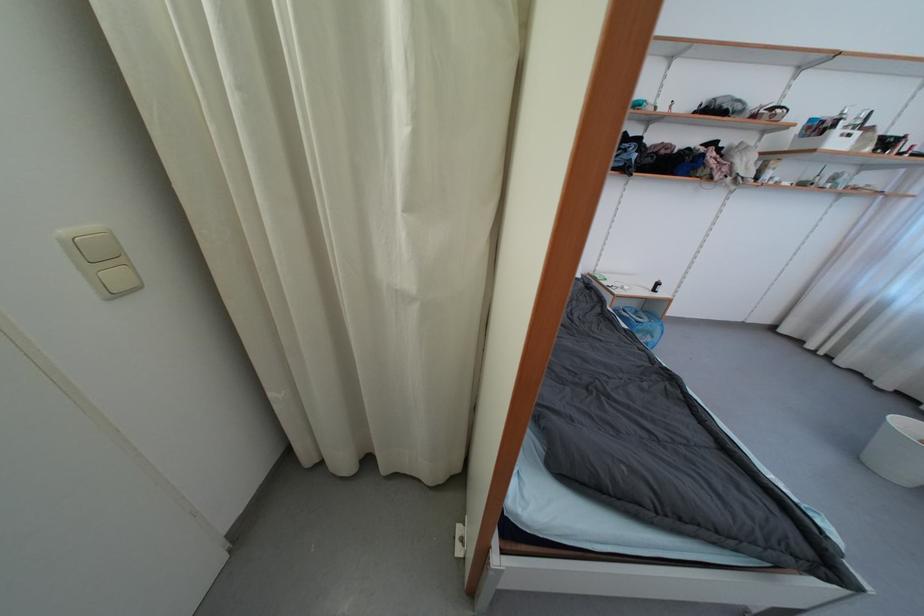
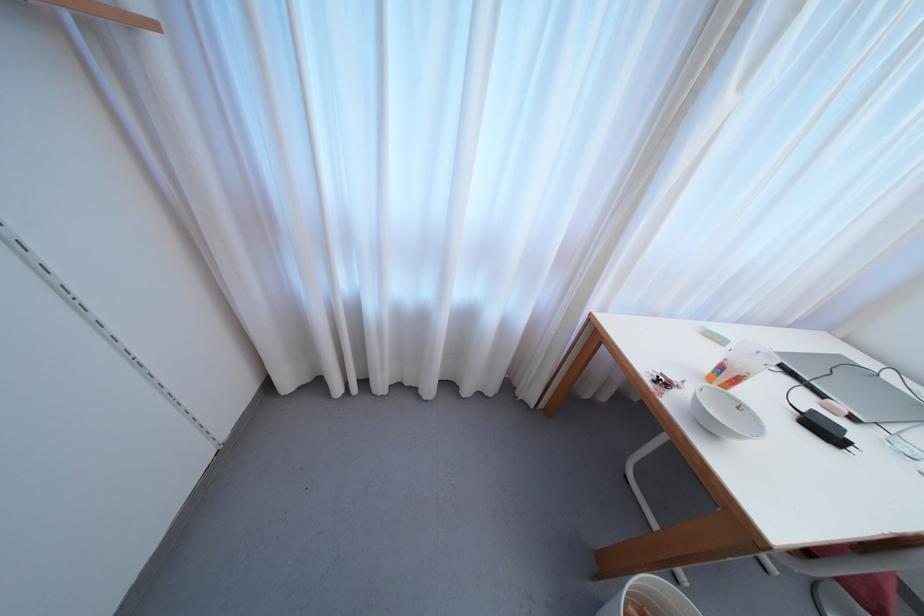
Locate, in the second image, the point that corresponds to point 813,349 in the first image.

(342, 392)